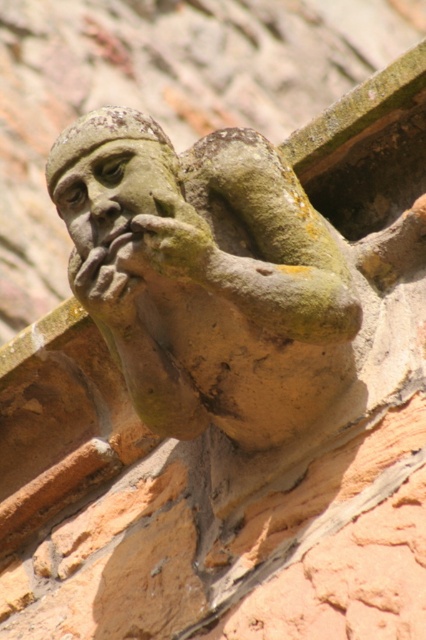
Question: Does stone gargoyle at center have a larger size compared to green mossy hand at center?

Choices:
 (A) no
 (B) yes

Answer: (B)

Question: Based on their relative distances, which object is nearer to the stone statue head at center?

Choices:
 (A) stone gargoyle at center
 (B) green mossy hand at center

Answer: (A)

Question: Does stone statue head at center have a larger size compared to stone textured hand at center?

Choices:
 (A) yes
 (B) no

Answer: (A)

Question: Which object is positioned closest to the stone statue head at center?

Choices:
 (A) green mossy hand at center
 (B) stone gargoyle at center

Answer: (B)

Question: Among these objects, which one is nearest to the camera?

Choices:
 (A) green mossy hand at center
 (B) stone gargoyle at center
 (C) stone textured hand at center
 (D) stone statue head at center

Answer: (A)

Question: Does stone statue head at center have a lesser width compared to stone textured hand at center?

Choices:
 (A) yes
 (B) no

Answer: (B)